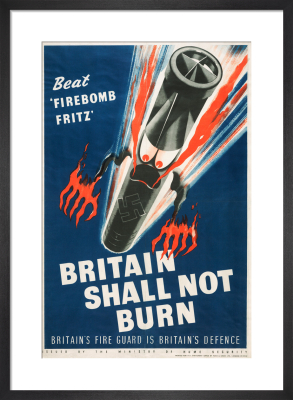
Find the location of `off white poster area with wording, poster bottom`. off white poster area with wording, poster bottom is located at coordinates (84, 351), (149, 353), (179, 352), (228, 350).